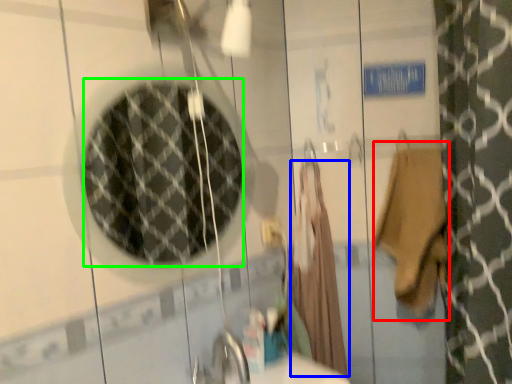
Question: Estimate the real-world distances between objects in this image. Which object is farther from bath towel (highlighted by a red box), robe (highlighted by a blue box) or mirror (highlighted by a green box)?

Choices:
 (A) robe
 (B) mirror

Answer: (B)